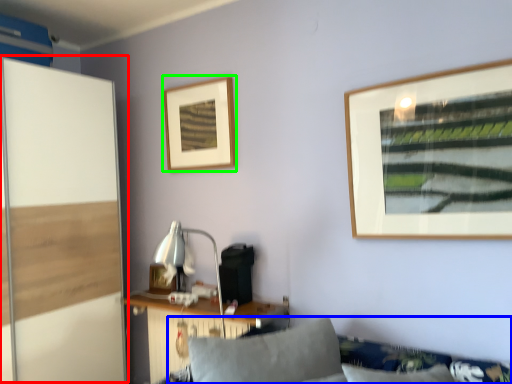
Question: Based on their relative distances, which object is farther from screen door (highlighted by a red box)? Choose from couch (highlighted by a blue box) and picture frame (highlighted by a green box).

Choices:
 (A) couch
 (B) picture frame

Answer: (A)